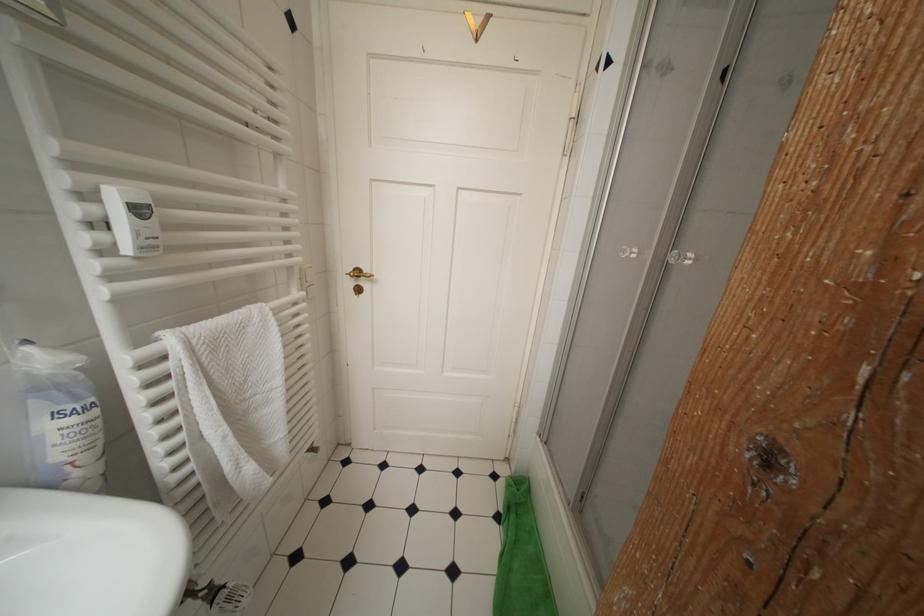
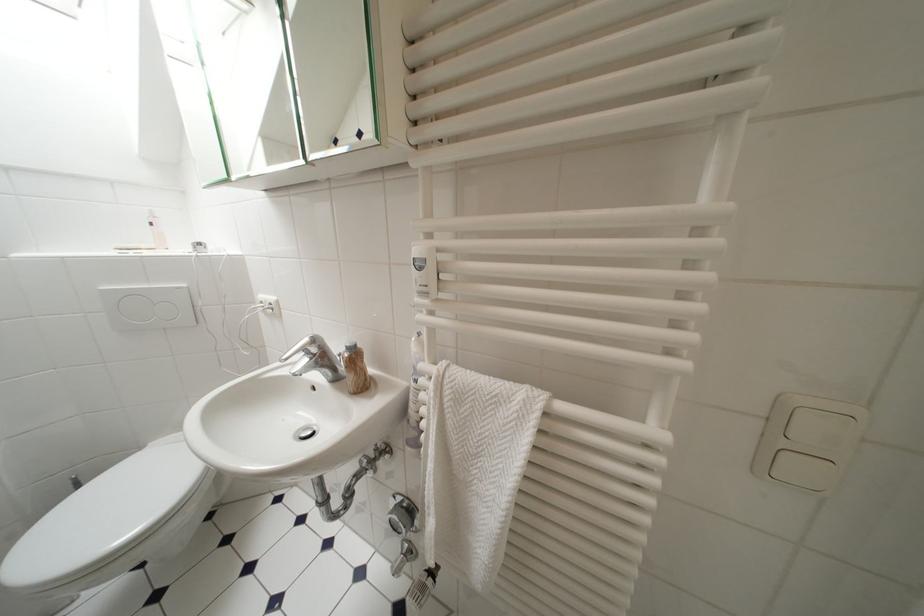
Question: I am providing you with two images of the same scene from different viewpoints. Please identify which objects are invisible in image2.

Choices:
 (A) white toilet lid
 (B) pink bottle
 (C) light switch button
 (D) none of these

Answer: (D)